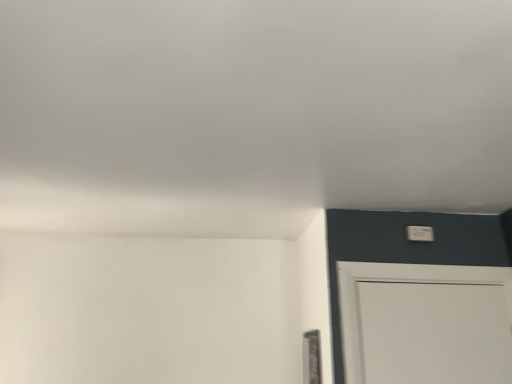
What do you see at coordinates (420, 233) in the screenshot? The image size is (512, 384). I see `white plastic light switch at upper right` at bounding box center [420, 233].

Where is `white plastic light switch at upper right`? The image size is (512, 384). white plastic light switch at upper right is located at coordinates [x=420, y=233].

At what (x,y) coordinates should I click in order to perform the action: click on clear glass window at lower right. Please return your answer as a coordinate pair (x, y). Looking at the image, I should click on (311, 357).

Measure the distance between clear glass window at lower right and camera.

clear glass window at lower right is 6.00 feet away from camera.

The image size is (512, 384). What do you see at coordinates (311, 357) in the screenshot?
I see `clear glass window at lower right` at bounding box center [311, 357].

At what (x,y) coordinates should I click in order to perform the action: click on white plastic light switch at upper right. Please return your answer as a coordinate pair (x, y). This screenshot has width=512, height=384. Looking at the image, I should click on (420, 233).

Considering the positions of objects clear glass window at lower right and white plastic light switch at upper right in the image provided, who is more to the right, clear glass window at lower right or white plastic light switch at upper right?

From the viewer's perspective, white plastic light switch at upper right appears more on the right side.

In the image, is clear glass window at lower right positioned in front of or behind white plastic light switch at upper right?

clear glass window at lower right is in front of white plastic light switch at upper right.

Which point is more forward, (313, 350) or (426, 236)?

The point (313, 350) is closer.

From the image's perspective, which one is positioned lower, clear glass window at lower right or white plastic light switch at upper right?

clear glass window at lower right, from the image's perspective.

From a real-world perspective, is clear glass window at lower right on top of white plastic light switch at upper right?

Incorrect, from a real-world perspective, clear glass window at lower right is lower than white plastic light switch at upper right.

Which of these two, clear glass window at lower right or white plastic light switch at upper right, is thinner?

clear glass window at lower right.

Does clear glass window at lower right have a greater height compared to white plastic light switch at upper right?

Yes, clear glass window at lower right is taller than white plastic light switch at upper right.

Based on the photo, is clear glass window at lower right smaller than white plastic light switch at upper right?

Actually, clear glass window at lower right might be larger than white plastic light switch at upper right.

Is clear glass window at lower right surrounding white plastic light switch at upper right?

No, white plastic light switch at upper right is located outside of clear glass window at lower right.

From the picture: Is clear glass window at lower right placed right next to white plastic light switch at upper right?

No, clear glass window at lower right is not in contact with white plastic light switch at upper right.

Is clear glass window at lower right aimed at white plastic light switch at upper right?

No, clear glass window at lower right is not facing towards white plastic light switch at upper right.

How different are the orientations of clear glass window at lower right and white plastic light switch at upper right in degrees?

clear glass window at lower right and white plastic light switch at upper right are facing 91.6 degrees away from each other.

Where is `window below the white plastic light switch at upper right (from a real-world perspective)`? window below the white plastic light switch at upper right (from a real-world perspective) is located at coordinates (311, 357).

Between white plastic light switch at upper right and clear glass window at lower right, which one appears on the right side from the viewer's perspective?

From the viewer's perspective, white plastic light switch at upper right appears more on the right side.

Who is more distant, white plastic light switch at upper right or clear glass window at lower right?

white plastic light switch at upper right is more distant.

Which point is more distant from viewer, (x=422, y=230) or (x=317, y=361)?

The point (x=422, y=230) is farther from the camera.

From the image's perspective, is white plastic light switch at upper right positioned above or below clear glass window at lower right?

Based on their image positions, white plastic light switch at upper right is located above clear glass window at lower right.

From a real-world perspective, which object rests below the other?

In real-world perspective, clear glass window at lower right is lower.

Based on the photo, looking at their sizes, would you say white plastic light switch at upper right is wider or thinner than clear glass window at lower right?

Clearly, white plastic light switch at upper right has more width compared to clear glass window at lower right.

Between white plastic light switch at upper right and clear glass window at lower right, which one has more height?

clear glass window at lower right.

In terms of size, does white plastic light switch at upper right appear bigger or smaller than clear glass window at lower right?

Considering their sizes, white plastic light switch at upper right takes up less space than clear glass window at lower right.

Can we say white plastic light switch at upper right lies outside clear glass window at lower right?

Indeed, white plastic light switch at upper right is completely outside clear glass window at lower right.

Is white plastic light switch at upper right not close to clear glass window at lower right?

No.

In the scene shown: Is white plastic light switch at upper right turned away from clear glass window at lower right?

white plastic light switch at upper right does not have its back to clear glass window at lower right.

At what (x,y) coordinates should I click in order to perform the action: click on light switch that is above the clear glass window at lower right (from the image's perspective). Please return your answer as a coordinate pair (x, y). The width and height of the screenshot is (512, 384). Looking at the image, I should click on (420, 233).

This screenshot has width=512, height=384. I want to click on light switch above the clear glass window at lower right (from the image's perspective), so click(420, 233).

Image resolution: width=512 pixels, height=384 pixels. I want to click on light switch that appears above the clear glass window at lower right (from a real-world perspective), so click(420, 233).